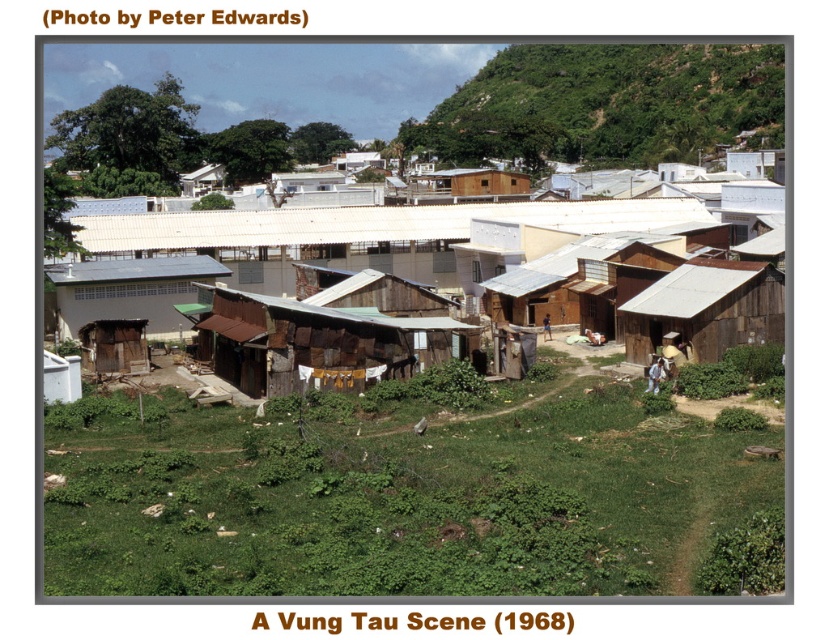
Question: Which object is closer to the camera taking this photo?

Choices:
 (A) green leafy hillside at upper right
 (B) rusty corrugated metal hut at center
 (C) rusty corrugated metal shacks at center

Answer: (B)

Question: Based on their relative distances, which object is nearer to the brown corrugated metal hut at lower left?

Choices:
 (A) rusty corrugated metal shacks at center
 (B) weathered wood hut at center-right
 (C) rusty corrugated metal hut at center

Answer: (A)

Question: Which point is farther to the camera?

Choices:
 (A) (182, 269)
 (B) (646, 300)
 (C) (480, 209)
 (D) (393, 317)

Answer: (C)

Question: Is rusty corrugated metal hut at center further to the viewer compared to weathered wood hut at center-right?

Choices:
 (A) yes
 (B) no

Answer: (B)

Question: Does green leafy hillside at upper right have a lesser width compared to rusty corrugated metal shacks at center?

Choices:
 (A) yes
 (B) no

Answer: (B)

Question: Does rusty corrugated metal hut at center appear on the right side of brown corrugated metal hut at lower left?

Choices:
 (A) no
 (B) yes

Answer: (B)